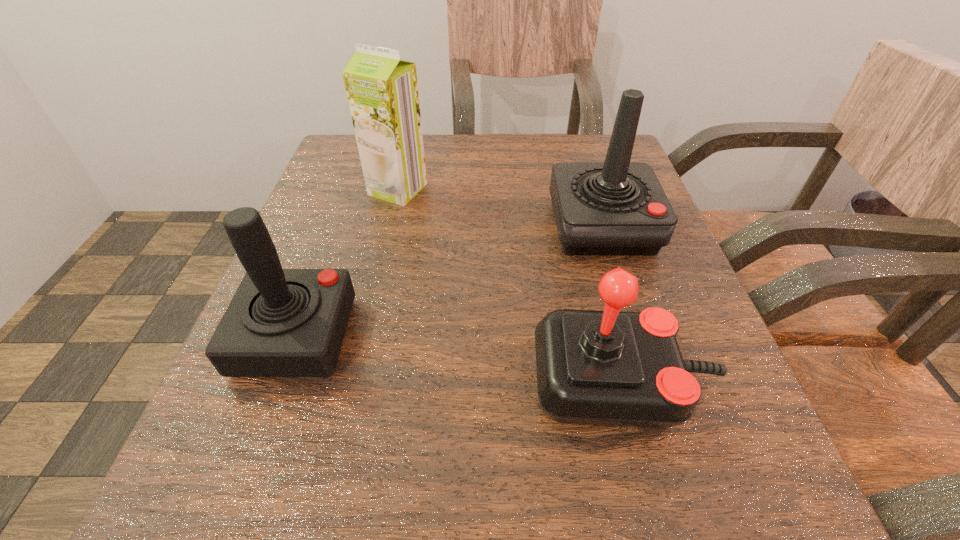
Where is `vacant area at the far edge`? vacant area at the far edge is located at coordinates (482, 155).

Find the location of a particular element. The height and width of the screenshot is (540, 960). vacant space at the near edge is located at coordinates (517, 476).

Locate an element on the screen. vacant area at the left edge is located at coordinates (346, 246).

This screenshot has width=960, height=540. I want to click on free space at the right edge, so click(735, 446).

Where is `vacant space at the far left corner of the desktop`? This screenshot has width=960, height=540. vacant space at the far left corner of the desktop is located at coordinates (348, 159).

In the image, there is a desktop. At what (x,y) coordinates should I click in order to perform the action: click on vacant region at the far right corner. Please return your answer as a coordinate pair (x, y). Looking at the image, I should click on (561, 133).

In the image, there is a desktop. Where is `free region at the near right corner`? free region at the near right corner is located at coordinates (768, 488).

Find the location of a particular element. vacant area that lies between the soya milk and the leftmost joystick is located at coordinates (347, 263).

You are a GUI agent. You are given a task and a screenshot of the screen. Output one action in this format:
    pyautogui.click(x=<x>, y=<y>)
    Task: Click on the free spot between the leftmost joystick and the farthest joystick
    The height and width of the screenshot is (540, 960).
    Given the screenshot: What is the action you would take?
    pyautogui.click(x=449, y=281)

This screenshot has width=960, height=540. What are the coordinates of `free space between the soya milk and the leftmost joystick` in the screenshot? It's located at (347, 263).